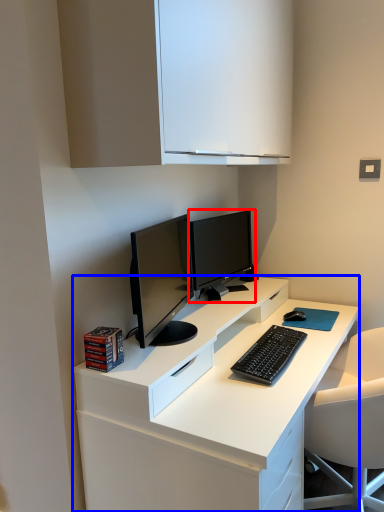
Question: Among these objects, which one is farthest to the camera, computer monitor (highlighted by a red box) or desk (highlighted by a blue box)?

Choices:
 (A) computer monitor
 (B) desk

Answer: (A)